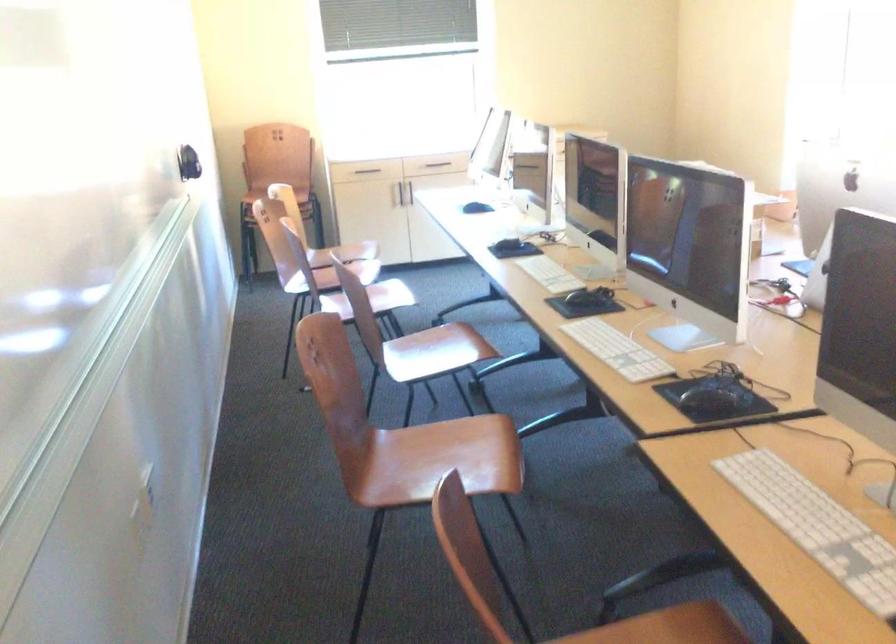
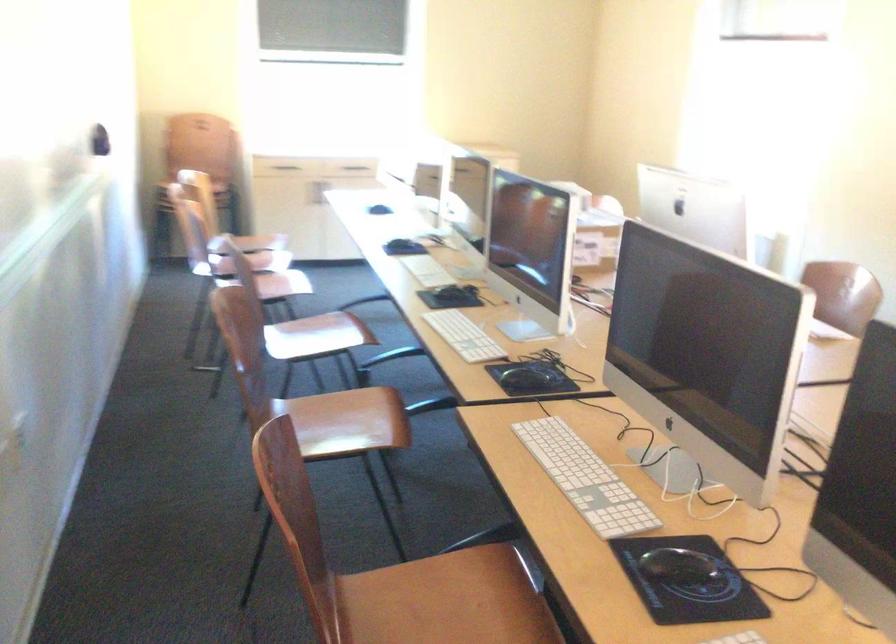
The images are taken continuously from a first-person perspective. In which direction are you moving?

The cameraman walked toward right, backward.